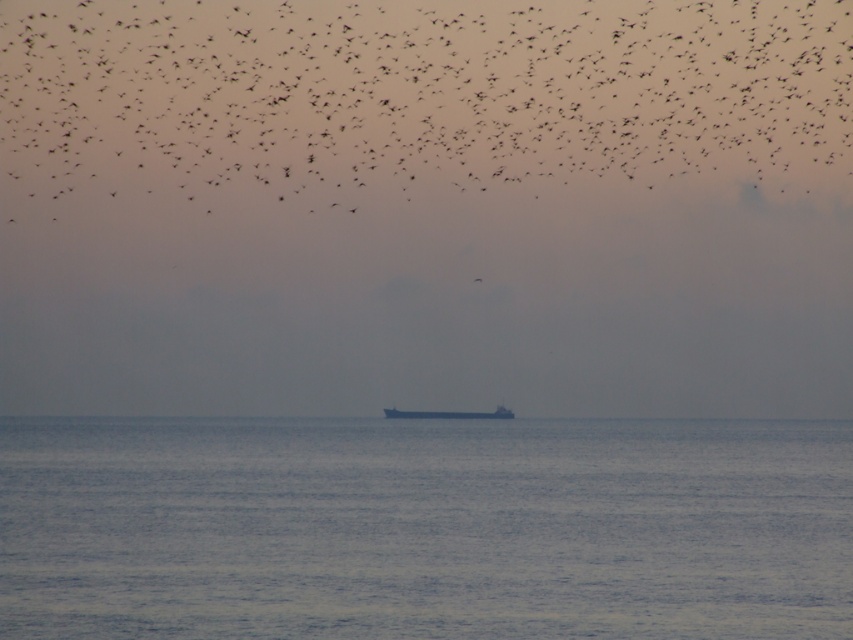
Question: Is gray metallic ship at center bigger than black matte bird at upper center?

Choices:
 (A) yes
 (B) no

Answer: (A)

Question: Which object is farther from the camera taking this photo?

Choices:
 (A) gray metallic ship at center
 (B) blue matte water at center

Answer: (A)

Question: Considering the relative positions of gray metallic ship at center and black matte bird at upper center in the image provided, where is gray metallic ship at center located with respect to black matte bird at upper center?

Choices:
 (A) below
 (B) above

Answer: (A)

Question: Does blue matte water at center appear under black matte bird at upper center?

Choices:
 (A) no
 (B) yes

Answer: (B)

Question: Which point is closer to the camera?

Choices:
 (A) gray metallic ship at center
 (B) blue matte water at center

Answer: (B)

Question: Which point is closer to the camera?

Choices:
 (A) blue matte water at center
 (B) black matte bird at upper center

Answer: (A)